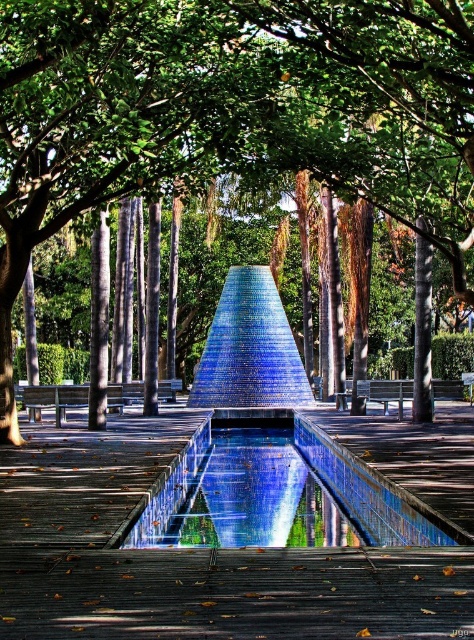
Between blue mosaic fountain at center and blue mosaic pyramid at center, which one has more height?

With more height is blue mosaic pyramid at center.

Does point (312, 589) come behind point (286, 339)?

No.

Image resolution: width=474 pixels, height=640 pixels. I want to click on blue mosaic fountain at center, so click(x=229, y=534).

Can you confirm if blue mosaic pyramid at center is bigger than wooden bench at center?

Yes, blue mosaic pyramid at center is bigger than wooden bench at center.

The image size is (474, 640). What do you see at coordinates (249, 348) in the screenshot?
I see `blue mosaic pyramid at center` at bounding box center [249, 348].

Where is `blue mosaic pyramid at center`? The width and height of the screenshot is (474, 640). blue mosaic pyramid at center is located at coordinates (249, 348).

Can you confirm if blue mosaic fountain at center is taller than blue mosaic pool at center?

Yes, blue mosaic fountain at center is taller than blue mosaic pool at center.

Locate an element on the screen. The width and height of the screenshot is (474, 640). blue mosaic fountain at center is located at coordinates (229, 534).